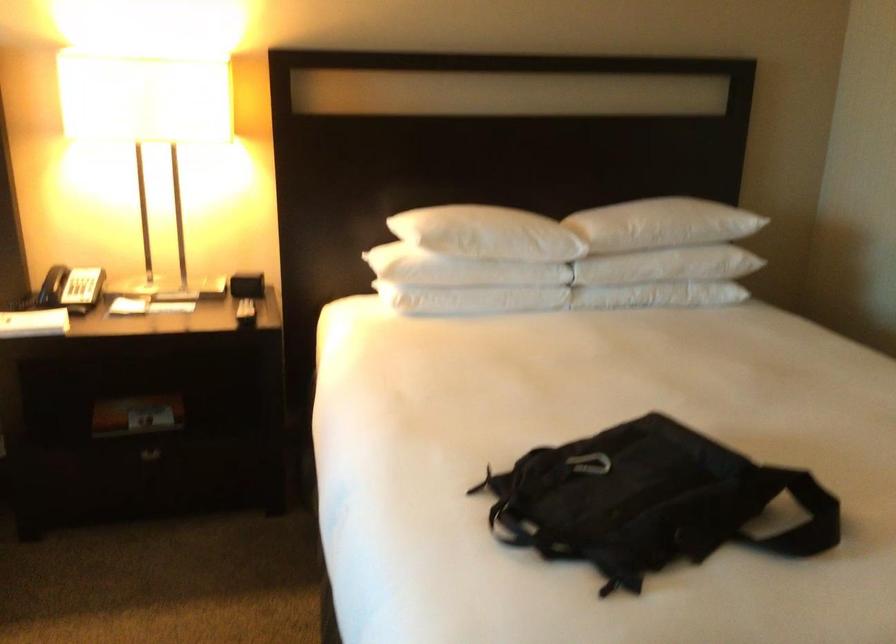
The image size is (896, 644). Describe the element at coordinates (811, 527) in the screenshot. I see `the backpack carabiner` at that location.